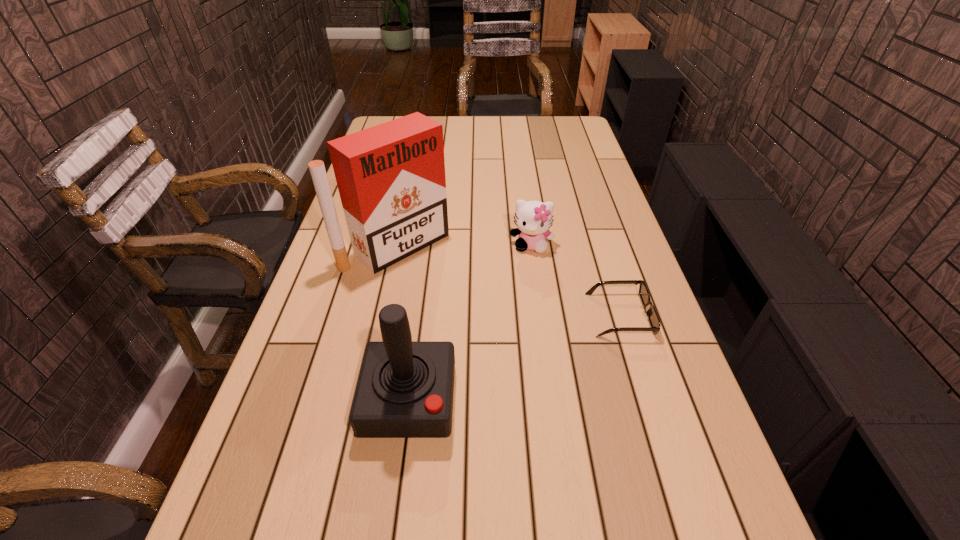
Where is `object that is the second nearest to the rightmost object`? object that is the second nearest to the rightmost object is located at coordinates (405, 389).

The width and height of the screenshot is (960, 540). Identify the location of object that is the third closest one to the cigarette case. (651, 313).

Identify the location of vacant point that satisfies the following two spatial constraints: 1. on the front side of the third farthest object; 2. on the front-facing side of the cigarette case. Image resolution: width=960 pixels, height=540 pixels. (382, 315).

Identify the location of free space that satisfies the following two spatial constraints: 1. on the back side of the third tallest object; 2. on the right side of the cigarette case. The height and width of the screenshot is (540, 960). [397, 245].

This screenshot has height=540, width=960. I want to click on free region that satisfies the following two spatial constraints: 1. on the front side of the kitten; 2. on the front-facing side of the third farthest object, so click(540, 315).